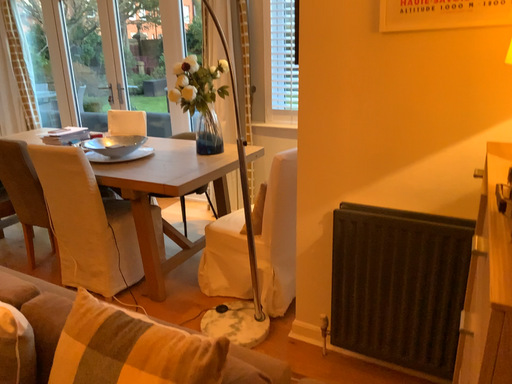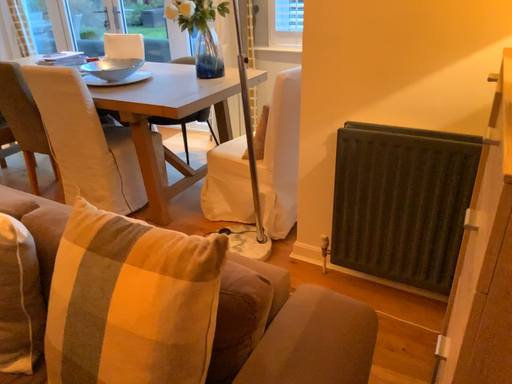
Question: Which way did the camera rotate in the video?

Choices:
 (A) rotated downward
 (B) rotated upward

Answer: (A)